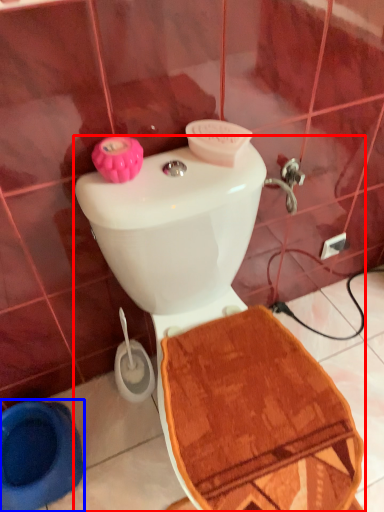
Question: Which point is further to the camera, toilet (highlighted by a red box) or toilet bowl (highlighted by a blue box)?

Choices:
 (A) toilet
 (B) toilet bowl

Answer: (B)